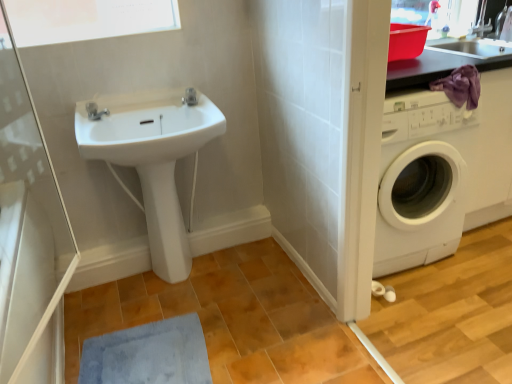
Measure the distance between white glossy bidet at center and camera.

white glossy bidet at center and camera are 1.78 meters apart from each other.

The width and height of the screenshot is (512, 384). What are the coordinates of `matte silver tap at upper left, which is the 1th tap in left-to-right order` in the screenshot? It's located at (95, 111).

Measure the distance between white glossy cabinet at lower left and camera.

A distance of 37.89 inches exists between white glossy cabinet at lower left and camera.

What do you see at coordinates (445, 63) in the screenshot? The height and width of the screenshot is (384, 512). I see `metallic gray countertop at upper right` at bounding box center [445, 63].

Where is `transparent glass screen door at upper left`? Image resolution: width=512 pixels, height=384 pixels. transparent glass screen door at upper left is located at coordinates (29, 234).

Is matte silver tap at upper left, which is the second tap from back to front, turned away from white glossy bidet at center?

matte silver tap at upper left, which is the second tap from back to front, does not have its back to white glossy bidet at center.

From the image's perspective, is matte silver tap at upper left, acting as the 1th tap starting from the front, below white glossy bidet at center?

No.

In the scene shown: Measure the distance between matte silver tap at upper left, which appears as the 2th tap when viewed from the top, and white glossy bidet at center.

matte silver tap at upper left, which appears as the 2th tap when viewed from the top, is 21.22 inches away from white glossy bidet at center.

Can we say white glossy sink at center lies outside white glossy cabinet at lower left?

white glossy sink at center lies outside white glossy cabinet at lower left's area.

Is white glossy sink at center with white glossy cabinet at lower left?

white glossy sink at center and white glossy cabinet at lower left are clearly separated.

Is white glossy sink at center taller than white glossy cabinet at lower left?

Incorrect, the height of white glossy sink at center is not larger of that of white glossy cabinet at lower left.

In the scene shown: Considering the sizes of objects white glossy sink at center and white glossy cabinet at lower left in the image provided, who is smaller, white glossy sink at center or white glossy cabinet at lower left?

With smaller size is white glossy sink at center.

In the image, is metallic gray countertop at upper right on the left side or the right side of white glossy sink at center?

metallic gray countertop at upper right is to the right of white glossy sink at center.

Considering the relative sizes of metallic gray countertop at upper right and white glossy sink at center in the image provided, is metallic gray countertop at upper right thinner than white glossy sink at center?

No, metallic gray countertop at upper right is not thinner than white glossy sink at center.

Which is closer to the camera, (453, 58) or (154, 194)?

Point (453, 58) is positioned closer to the camera compared to point (154, 194).

Is metallic gray countertop at upper right turned away from white glossy sink at center?

No, metallic gray countertop at upper right is not facing the opposite direction of white glossy sink at center.

Does point (135, 167) lie in front of point (423, 57)?

No, it is not.

Is white glossy bidet at center aimed at metallic gray countertop at upper right?

No.

Can you confirm if white glossy bidet at center is bigger than metallic gray countertop at upper right?

Incorrect, white glossy bidet at center is not larger than metallic gray countertop at upper right.

Is white glossy bidet at center to the left or to the right of metallic gray countertop at upper right in the image?

From the image, it's evident that white glossy bidet at center is to the left of metallic gray countertop at upper right.

Is metallic gray countertop at upper right facing away from blue soft bath mat at lower left?

No, metallic gray countertop at upper right's orientation is not away from blue soft bath mat at lower left.

Which is closer to the camera, (390, 84) or (84, 370)?

Point (390, 84).

In the scene shown: Are metallic gray countertop at upper right and blue soft bath mat at lower left beside each other?

metallic gray countertop at upper right is not next to blue soft bath mat at lower left, and they're not touching.

Which of these two, metallic gray countertop at upper right or blue soft bath mat at lower left, is bigger?

With larger size is metallic gray countertop at upper right.

Which object is thinner, transparent glass screen door at upper left or metallic gray countertop at upper right?

transparent glass screen door at upper left.

From the image's perspective, would you say transparent glass screen door at upper left is positioned over metallic gray countertop at upper right?

No.

Locate an element on the screen. The image size is (512, 384). screen door in front of the metallic gray countertop at upper right is located at coordinates (29, 234).

Which is closer, (x=65, y=255) or (x=437, y=68)?

Point (x=65, y=255) is positioned farther from the camera compared to point (x=437, y=68).

Locate an element on the screen. The width and height of the screenshot is (512, 384). bath mat below the metallic gray countertop at upper right (from the image's perspective) is located at coordinates (148, 354).

From a real-world perspective, does blue soft bath mat at lower left stand above metallic gray countertop at upper right?

No, from a real-world perspective, blue soft bath mat at lower left is not on top of metallic gray countertop at upper right.

Is blue soft bath mat at lower left inside the boundaries of metallic gray countertop at upper right, or outside?

blue soft bath mat at lower left is not inside metallic gray countertop at upper right, it's outside.

Who is shorter, blue soft bath mat at lower left or metallic gray countertop at upper right?

blue soft bath mat at lower left.

From the image's perspective, starting from the white glossy bidet at center, which tap is the 1st one above? Please provide its 2D coordinates.

[(95, 111)]

You are a GUI agent. You are given a task and a screenshot of the screen. Output one action in this format:
    pyautogui.click(x=<x>, y=<y>)
    Task: Click on the appliance below the white glossy sink at center (from the image's perspective)
    
    Given the screenshot: What is the action you would take?
    pyautogui.click(x=22, y=272)

Based on their spatial positions, is blue soft bath mat at lower left or white glossy cabinet at lower left further from white glossy bidet at center?

The object further to white glossy bidet at center is white glossy cabinet at lower left.

Looking at the image, which one is located further to satin chrome faucet at upper center, the 1th tap when ordered from top to bottom, white glossy cabinet at lower left or blue soft bath mat at lower left?

blue soft bath mat at lower left is positioned further to the anchor satin chrome faucet at upper center, the 1th tap when ordered from top to bottom.

Which object lies further to the anchor point metallic gray countertop at upper right, blue soft bath mat at lower left or white glossy bidet at center?

blue soft bath mat at lower left is further to metallic gray countertop at upper right.

In the scene shown: Considering their positions, is blue soft bath mat at lower left positioned further to matte silver tap at upper left, which is the 1th tap in left-to-right order, than satin chrome faucet at upper center, which ranks as the first tap in right-to-left order?

Among the two, blue soft bath mat at lower left is located further to matte silver tap at upper left, which is the 1th tap in left-to-right order.

Considering their positions, is transparent glass screen door at upper left positioned closer to white glossy bidet at center than white glossy sink at center?

white glossy sink at center.

Estimate the real-world distances between objects in this image. Which object is further from white glossy sink at center, white glossy cabinet at lower left or transparent glass screen door at upper left?

The object further to white glossy sink at center is white glossy cabinet at lower left.

Looking at the image, which one is located further to white glossy cabinet at lower left, white glossy sink at center or metallic gray countertop at upper right?

The object further to white glossy cabinet at lower left is metallic gray countertop at upper right.

Based on their spatial positions, is blue soft bath mat at lower left or white glossy bidet at center closer to transparent glass screen door at upper left?

The object closer to transparent glass screen door at upper left is blue soft bath mat at lower left.

I want to click on bath mat between matte silver tap at upper left, which is the 1th tap in left-to-right order, and metallic gray countertop at upper right, so click(148, 354).

Image resolution: width=512 pixels, height=384 pixels. What are the coordinates of `sink between transparent glass screen door at upper left and satin chrome faucet at upper center, acting as the 1th tap starting from the back, from front to back` in the screenshot? It's located at (153, 160).

This screenshot has height=384, width=512. What are the coordinates of `tap between white glossy sink at center and metallic gray countertop at upper right in the horizontal direction` in the screenshot? It's located at (190, 97).

Where is `appliance between satin chrome faucet at upper center, the 2th tap when ordered from bottom to top, and blue soft bath mat at lower left, in the vertical direction`? appliance between satin chrome faucet at upper center, the 2th tap when ordered from bottom to top, and blue soft bath mat at lower left, in the vertical direction is located at coordinates (22, 272).